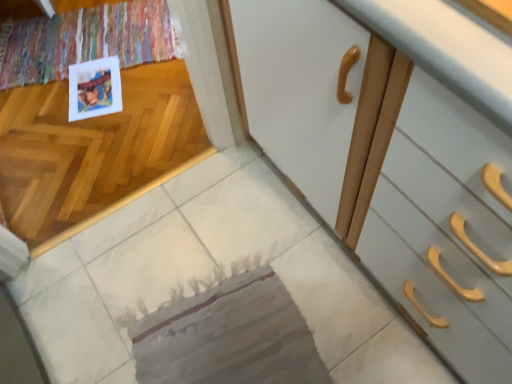
Where is `vacant point above matte paper postcard at upper left (from a real-world perspective)`? The image size is (512, 384). vacant point above matte paper postcard at upper left (from a real-world perspective) is located at coordinates (92, 81).